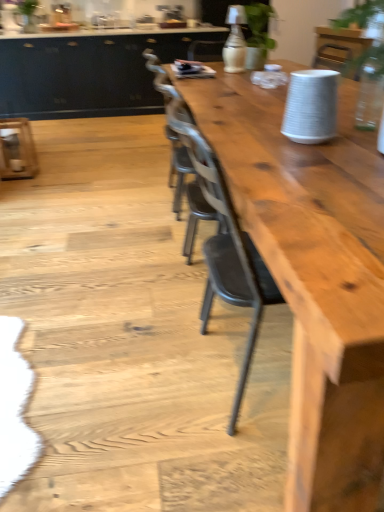
The image size is (384, 512). I want to click on natural wood table at center, so click(x=313, y=278).

What do you see at coordinates (313, 278) in the screenshot? I see `natural wood table at center` at bounding box center [313, 278].

The image size is (384, 512). Describe the element at coordinates (88, 72) in the screenshot. I see `matte black cabinetry at upper left` at that location.

You are a GUI agent. You are given a task and a screenshot of the screen. Output one action in this format:
    pyautogui.click(x=<x>, y=<y>)
    Task: Click on the matte black cabinetry at upper left
    Image resolution: width=384 pixels, height=512 pixels.
    Given the screenshot: What is the action you would take?
    88,72

Where is `natural wood table at center`? This screenshot has height=512, width=384. natural wood table at center is located at coordinates (313, 278).

In the scene shown: Does natural wood table at center appear on the left side of matte black cabinetry at upper left?

Incorrect, natural wood table at center is not on the left side of matte black cabinetry at upper left.

Which object is more forward, natural wood table at center or matte black cabinetry at upper left?

natural wood table at center.

Is point (343, 493) in front of point (99, 84)?

Yes.

From the image's perspective, is natural wood table at center above matte black cabinetry at upper left?

Actually, natural wood table at center appears below matte black cabinetry at upper left in the image.

From a real-world perspective, is natural wood table at center physically above matte black cabinetry at upper left?

Incorrect, from a real-world perspective, natural wood table at center is lower than matte black cabinetry at upper left.

Between natural wood table at center and matte black cabinetry at upper left, which one has smaller width?

matte black cabinetry at upper left.

Which of these two, natural wood table at center or matte black cabinetry at upper left, stands shorter?

Standing shorter between the two is natural wood table at center.

Is natural wood table at center smaller than matte black cabinetry at upper left?

Indeed, natural wood table at center has a smaller size compared to matte black cabinetry at upper left.

Is natural wood table at center inside or outside of matte black cabinetry at upper left?

natural wood table at center is located beyond the bounds of matte black cabinetry at upper left.

Are natural wood table at center and matte black cabinetry at upper left far apart?

Yes.

Could you tell me if natural wood table at center is turned towards matte black cabinetry at upper left?

Yes, natural wood table at center is oriented towards matte black cabinetry at upper left.

How different are the orientations of natural wood table at center and matte black cabinetry at upper left in degrees?

The angular difference between natural wood table at center and matte black cabinetry at upper left is 179 degrees.

Locate an element on the screen. This screenshot has width=384, height=512. table that appears below the matte black cabinetry at upper left (from the image's perspective) is located at coordinates (313, 278).

Which object is positioned more to the right, matte black cabinetry at upper left or natural wood table at center?

natural wood table at center is more to the right.

Is the position of matte black cabinetry at upper left less distant than that of natural wood table at center?

No, the depth of matte black cabinetry at upper left is greater than that of natural wood table at center.

Does point (56, 56) come behind point (275, 145)?

Yes, point (56, 56) is farther from viewer.

In the scene shown: From the image's perspective, is matte black cabinetry at upper left above or below natural wood table at center?

Based on their image positions, matte black cabinetry at upper left is located above natural wood table at center.

From a real-world perspective, does matte black cabinetry at upper left sit lower than natural wood table at center?

No.

Does matte black cabinetry at upper left have a lesser width compared to natural wood table at center?

Indeed, matte black cabinetry at upper left has a lesser width compared to natural wood table at center.

Is matte black cabinetry at upper left taller or shorter than natural wood table at center?

In the image, matte black cabinetry at upper left appears to be taller than natural wood table at center.

Considering the sizes of matte black cabinetry at upper left and natural wood table at center in the image, is matte black cabinetry at upper left bigger or smaller than natural wood table at center?

Considering their sizes, matte black cabinetry at upper left takes up more space than natural wood table at center.

Can we say matte black cabinetry at upper left lies outside natural wood table at center?

matte black cabinetry at upper left lies outside natural wood table at center's area.

Would you say matte black cabinetry at upper left is a long distance from natural wood table at center?

Yes, matte black cabinetry at upper left and natural wood table at center are located far from each other.

Is matte black cabinetry at upper left facing away from natural wood table at center?

That's not correct — matte black cabinetry at upper left is not looking away from natural wood table at center.

How distant is matte black cabinetry at upper left from natural wood table at center?

They are 4.09 meters apart.

In order to click on cabinetry above the natural wood table at center (from a real-world perspective) in this screenshot , I will do `click(88, 72)`.

The image size is (384, 512). I want to click on cabinetry positioned vertically above the natural wood table at center (from a real-world perspective), so click(x=88, y=72).

This screenshot has height=512, width=384. What are the coordinates of `table below the matte black cabinetry at upper left (from the image's perspective)` in the screenshot? It's located at (313, 278).